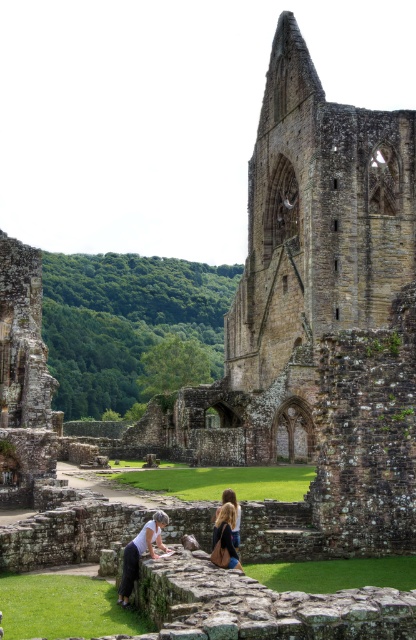
Question: Is matte black hair at lower center bigger than blonde hair at center?

Choices:
 (A) yes
 (B) no

Answer: (A)

Question: Can you confirm if green grass at lower center is smaller than white cotton shirt at lower left?

Choices:
 (A) no
 (B) yes

Answer: (A)

Question: Among these points, which one is nearest to the camera?

Choices:
 (A) (153, 554)
 (B) (146, 545)
 (C) (223, 480)
 (D) (247, 564)

Answer: (A)

Question: Among these points, which one is farthest from the camera?

Choices:
 (A) (136, 561)
 (B) (188, 477)
 (C) (348, 577)
 (D) (225, 520)

Answer: (B)

Question: Is white cotton shirt at lower left further to camera compared to blonde hair at center?

Choices:
 (A) yes
 (B) no

Answer: (B)

Question: Which point is farther to the camera?

Choices:
 (A) blonde hair at center
 (B) white cotton shirt at lower left
 (C) green grass at center
 (D) green grass at lower left

Answer: (C)